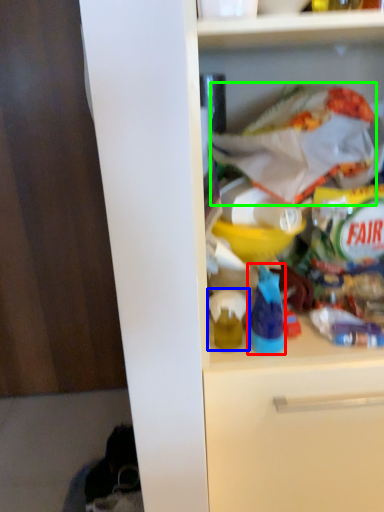
Question: Which object is positioned farthest from bottle (highlighted by a red box)? Select from toy (highlighted by a blue box) and material (highlighted by a green box).

Choices:
 (A) toy
 (B) material

Answer: (B)